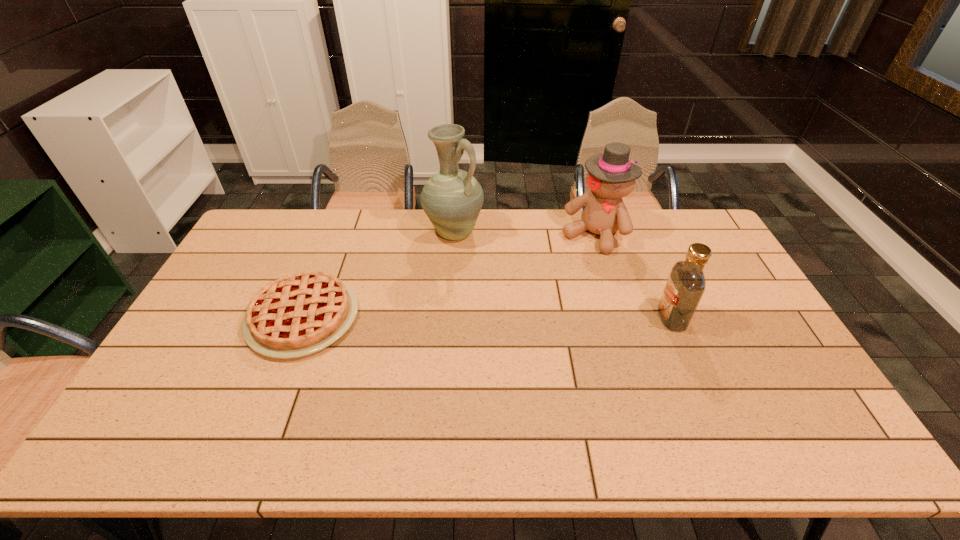
I want to click on pie, so click(302, 313).

Image resolution: width=960 pixels, height=540 pixels. I want to click on the leftmost object, so click(x=302, y=313).

In order to click on the rightmost object in this screenshot , I will do `click(686, 284)`.

Find the location of a particular element. vodka is located at coordinates (686, 284).

At what (x,y) coordinates should I click in order to perform the action: click on pitcher. Please return your answer as a coordinate pair (x, y). Looking at the image, I should click on (452, 198).

Identify the location of the second object from left to right. This screenshot has width=960, height=540. (452, 198).

Locate an element on the screen. This screenshot has height=540, width=960. the third shortest object is located at coordinates (611, 176).

Find the location of a particular element. rag_doll is located at coordinates (611, 176).

The height and width of the screenshot is (540, 960). Find the location of `vacant space located 0.370m on the right of the shortest object`. vacant space located 0.370m on the right of the shortest object is located at coordinates (482, 317).

Find the location of a particular element. This screenshot has height=540, width=960. free space located 0.230m on the front-facing side of the third tallest object is located at coordinates (582, 318).